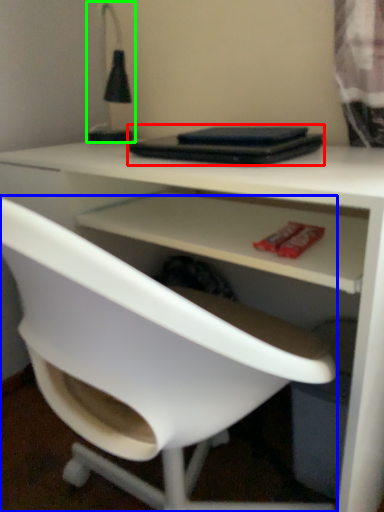
Question: Which is farther away from laptop (highlighted by a red box)? chair (highlighted by a blue box) or table lamp (highlighted by a green box)?

Choices:
 (A) chair
 (B) table lamp

Answer: (A)